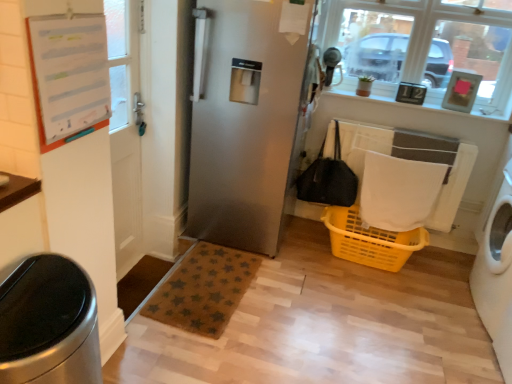
This screenshot has height=384, width=512. I want to click on vacant space to the left of yellow plastic laundry basket at lower center, so click(297, 263).